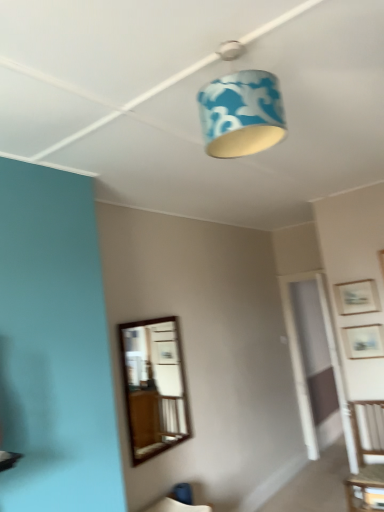
In order to face wooden picture frame at upper right, placed as the second picture frame when sorted from top to bottom, should I rotate leftwards or rightwards?

Turn right approximately 22.033 degrees to face it.

Identify the location of wooden picture frame at upper right, which appears as the 1th picture frame when ordered from the bottom. The height and width of the screenshot is (512, 384). (364, 341).

What do you see at coordinates (366, 454) in the screenshot? I see `wooden chair at right` at bounding box center [366, 454].

Locate an element on the screen. Image resolution: width=384 pixels, height=512 pixels. wooden picture frame at upper right, which is the 1th picture frame from top to bottom is located at coordinates (357, 297).

Identify the location of blue fabric lampshade at upper center. The height and width of the screenshot is (512, 384). (241, 114).

Where is `mirror above the wooden table at lower right (from the image's perspective)`? mirror above the wooden table at lower right (from the image's perspective) is located at coordinates (154, 386).

How many degrees apart are the facing directions of wooden table at lower right and wooden-framed mirror at center?

The angular difference between wooden table at lower right and wooden-framed mirror at center is 89.6 degrees.

Is wooden table at lower right situated inside wooden-framed mirror at center or outside?

wooden table at lower right is located beyond the bounds of wooden-framed mirror at center.

Measure the distance from wooden table at lower right to wooden-framed mirror at center.

wooden table at lower right is 6.68 feet from wooden-framed mirror at center.

Is wooden picture frame at upper right, placed as the second picture frame when sorted from bottom to top, with wooden picture frame at upper right, placed as the second picture frame when sorted from top to bottom?

No.

From the image's perspective, is wooden picture frame at upper right, placed as the second picture frame when sorted from bottom to top, positioned above or below wooden picture frame at upper right, which appears as the 1th picture frame when ordered from the bottom?

wooden picture frame at upper right, placed as the second picture frame when sorted from bottom to top, is situated higher than wooden picture frame at upper right, which appears as the 1th picture frame when ordered from the bottom, in the image.

Who is bigger, wooden picture frame at upper right, which is the 1th picture frame from top to bottom, or wooden picture frame at upper right, which appears as the 1th picture frame when ordered from the bottom?

With larger size is wooden picture frame at upper right, which appears as the 1th picture frame when ordered from the bottom.

Is wooden picture frame at upper right, which appears as the 1th picture frame when ordered from the bottom, completely or partially inside wooden picture frame at upper right, which is the 1th picture frame from top to bottom?

Definitely not — wooden picture frame at upper right, which appears as the 1th picture frame when ordered from the bottom, is not inside wooden picture frame at upper right, which is the 1th picture frame from top to bottom.

From the image's perspective, is wooden picture frame at upper right, which appears as the 1th picture frame when ordered from the bottom, beneath blue fabric lampshade at upper center?

Yes, from the image's perspective, wooden picture frame at upper right, which appears as the 1th picture frame when ordered from the bottom, is beneath blue fabric lampshade at upper center.

Is wooden picture frame at upper right, placed as the second picture frame when sorted from top to bottom, in front of blue fabric lampshade at upper center?

No, wooden picture frame at upper right, placed as the second picture frame when sorted from top to bottom, is further to the viewer.

Is wooden picture frame at upper right, placed as the second picture frame when sorted from top to bottom, in contact with blue fabric lampshade at upper center?

No, wooden picture frame at upper right, placed as the second picture frame when sorted from top to bottom, is not with blue fabric lampshade at upper center.

Is wooden picture frame at upper right, placed as the second picture frame when sorted from top to bottom, bigger than blue fabric lampshade at upper center?

No, wooden picture frame at upper right, placed as the second picture frame when sorted from top to bottom, is not bigger than blue fabric lampshade at upper center.

From the picture: Would you say wooden-framed mirror at center is inside or outside wooden table at lower right?

wooden-framed mirror at center is outside wooden table at lower right.

The image size is (384, 512). I want to click on mirror that is in front of the wooden table at lower right, so click(x=154, y=386).

Which of these two, wooden-framed mirror at center or wooden table at lower right, is thinner?

wooden-framed mirror at center.

Is wooden-framed mirror at center positioned with its back to wooden table at lower right?

No.

From the image's perspective, which is above, wooden picture frame at upper right, which appears as the 1th picture frame when ordered from the bottom, or wooden picture frame at upper right, placed as the second picture frame when sorted from bottom to top?

wooden picture frame at upper right, placed as the second picture frame when sorted from bottom to top, appears higher in the image.

From a real-world perspective, is wooden picture frame at upper right, which appears as the 1th picture frame when ordered from the bottom, physically above wooden picture frame at upper right, placed as the second picture frame when sorted from bottom to top?

No.

Which object is positioned more to the left, wooden picture frame at upper right, placed as the second picture frame when sorted from top to bottom, or wooden picture frame at upper right, placed as the second picture frame when sorted from bottom to top?

From the viewer's perspective, wooden picture frame at upper right, placed as the second picture frame when sorted from bottom to top, appears more on the left side.

Considering the sizes of wooden picture frame at upper right, which appears as the 1th picture frame when ordered from the bottom, and wooden picture frame at upper right, which is the 1th picture frame from top to bottom, in the image, is wooden picture frame at upper right, which appears as the 1th picture frame when ordered from the bottom, bigger or smaller than wooden picture frame at upper right, which is the 1th picture frame from top to bottom,?

Considering their sizes, wooden picture frame at upper right, which appears as the 1th picture frame when ordered from the bottom, takes up more space than wooden picture frame at upper right, which is the 1th picture frame from top to bottom.

Could wooden table at lower right be considered to be inside blue fabric lampshade at upper center?

Definitely not — wooden table at lower right is not inside blue fabric lampshade at upper center.

Which is behind, blue fabric lampshade at upper center or wooden table at lower right?

Positioned behind is wooden table at lower right.

Considering the relative positions of blue fabric lampshade at upper center and wooden table at lower right in the image provided, is blue fabric lampshade at upper center to the left of wooden table at lower right from the viewer's perspective?

Yes, blue fabric lampshade at upper center is to the left of wooden table at lower right.

Between wooden chair at right and wooden table at lower right, which one appears on the right side from the viewer's perspective?

wooden chair at right is more to the right.

Considering the relative sizes of wooden chair at right and wooden table at lower right in the image provided, is wooden chair at right bigger than wooden table at lower right?

Indeed, wooden chair at right has a larger size compared to wooden table at lower right.

In order to click on furniture lying on the right of wooden table at lower right in this screenshot , I will do `click(366, 454)`.

Is wooden chair at right oriented away from wooden table at lower right?

Yes, wooden chair at right is positioned with its back facing wooden table at lower right.

In the image, there is a wooden-framed mirror at center. At what (x,y) coordinates should I click in order to perform the action: click on table below it (from the image's perspective). Please return your answer as a coordinate pair (x, y). The width and height of the screenshot is (384, 512). Looking at the image, I should click on point(366,488).

You are a GUI agent. You are given a task and a screenshot of the screen. Output one action in this format:
    pyautogui.click(x=<x>, y=<y>)
    Task: Click on the picture frame that is above the wooden picture frame at upper right, placed as the second picture frame when sorted from top to bottom (from the image's perspective)
    
    Given the screenshot: What is the action you would take?
    pyautogui.click(x=357, y=297)

Considering their positions, is blue fabric lampshade at upper center positioned further to wooden chair at right than wooden picture frame at upper right, which appears as the 1th picture frame when ordered from the bottom?

blue fabric lampshade at upper center.

Looking at the image, which one is located further to blue fabric lampshade at upper center, wooden chair at right or wooden picture frame at upper right, which appears as the 1th picture frame when ordered from the bottom?

Based on the image, wooden chair at right appears to be further to blue fabric lampshade at upper center.

From the picture: Based on their spatial positions, is wooden table at lower right or wooden-framed mirror at center closer to wooden picture frame at upper right, placed as the second picture frame when sorted from bottom to top?

wooden table at lower right is closer to wooden picture frame at upper right, placed as the second picture frame when sorted from bottom to top.

Looking at the image, which one is located closer to wooden table at lower right, wooden-framed mirror at center or wooden picture frame at upper right, placed as the second picture frame when sorted from top to bottom?

wooden picture frame at upper right, placed as the second picture frame when sorted from top to bottom, is positioned closer to the anchor wooden table at lower right.

Which object lies further to the anchor point wooden table at lower right, wooden picture frame at upper right, which is the 1th picture frame from top to bottom, or wooden-framed mirror at center?

Based on the image, wooden-framed mirror at center appears to be further to wooden table at lower right.

Considering their positions, is wooden picture frame at upper right, which is the 1th picture frame from top to bottom, positioned closer to wooden chair at right than wooden table at lower right?

wooden table at lower right is positioned closer to the anchor wooden chair at right.

From the image, which object appears to be farther from wooden table at lower right, wooden chair at right or wooden picture frame at upper right, which is the 1th picture frame from top to bottom?

wooden picture frame at upper right, which is the 1th picture frame from top to bottom.

Which object lies further to the anchor point wooden table at lower right, blue fabric lampshade at upper center or wooden picture frame at upper right, which appears as the 1th picture frame when ordered from the bottom?

Based on the image, blue fabric lampshade at upper center appears to be further to wooden table at lower right.

I want to click on mirror located between blue fabric lampshade at upper center and wooden picture frame at upper right, placed as the second picture frame when sorted from top to bottom, in the depth direction, so click(154, 386).

You are a GUI agent. You are given a task and a screenshot of the screen. Output one action in this format:
    pyautogui.click(x=<x>, y=<y>)
    Task: Click on the furniture between blue fabric lampshade at upper center and wooden table at lower right in the vertical direction
    Image resolution: width=384 pixels, height=512 pixels.
    Given the screenshot: What is the action you would take?
    pyautogui.click(x=366, y=454)

Where is `picture frame between wooden-framed mirror at center and wooden picture frame at upper right, placed as the second picture frame when sorted from top to bottom, from left to right`? Image resolution: width=384 pixels, height=512 pixels. picture frame between wooden-framed mirror at center and wooden picture frame at upper right, placed as the second picture frame when sorted from top to bottom, from left to right is located at coordinates (357, 297).

The image size is (384, 512). Identify the location of picture frame located between blue fabric lampshade at upper center and wooden picture frame at upper right, which is the 1th picture frame from top to bottom, in the depth direction. (364, 341).